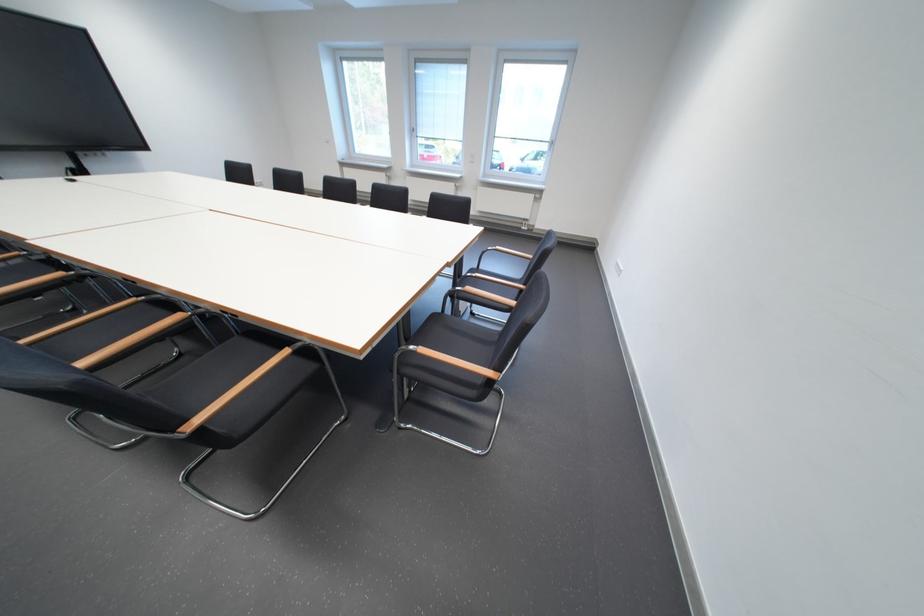
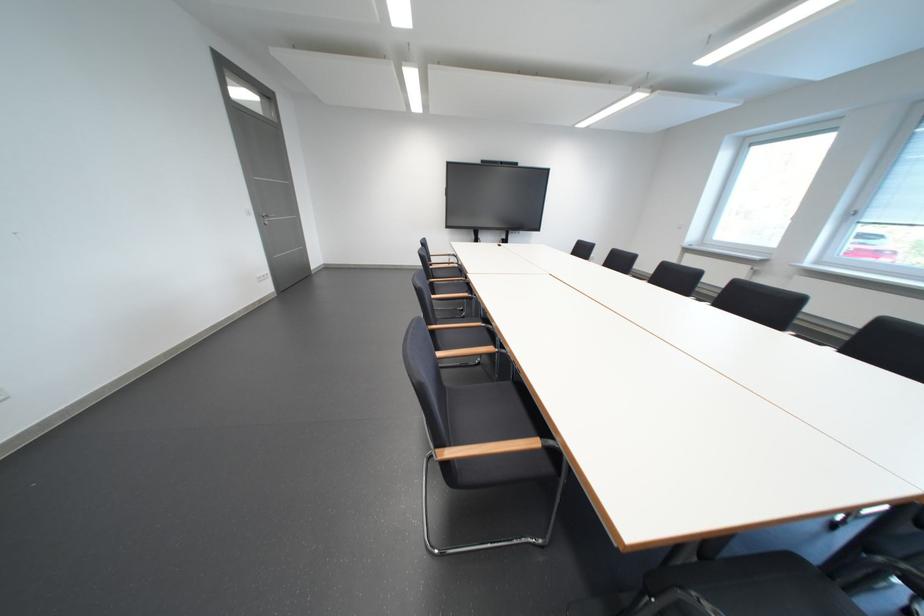
Question: The images are taken continuously from a first-person perspective. In which direction is your viewpoint rotating?

Choices:
 (A) Left
 (B) Right
 (C) Up
 (D) Down

Answer: (A)